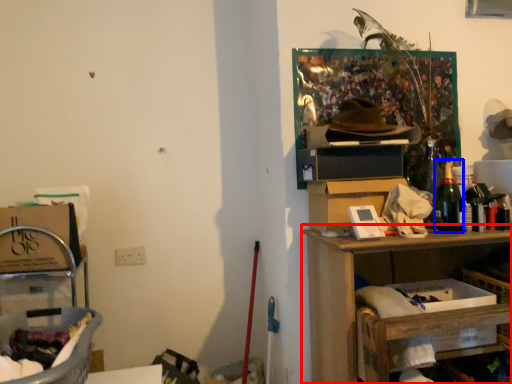
Question: Among these objects, which one is nearest to the camera, shelf (highlighted by a red box) or bottle (highlighted by a blue box)?

Choices:
 (A) shelf
 (B) bottle

Answer: (A)